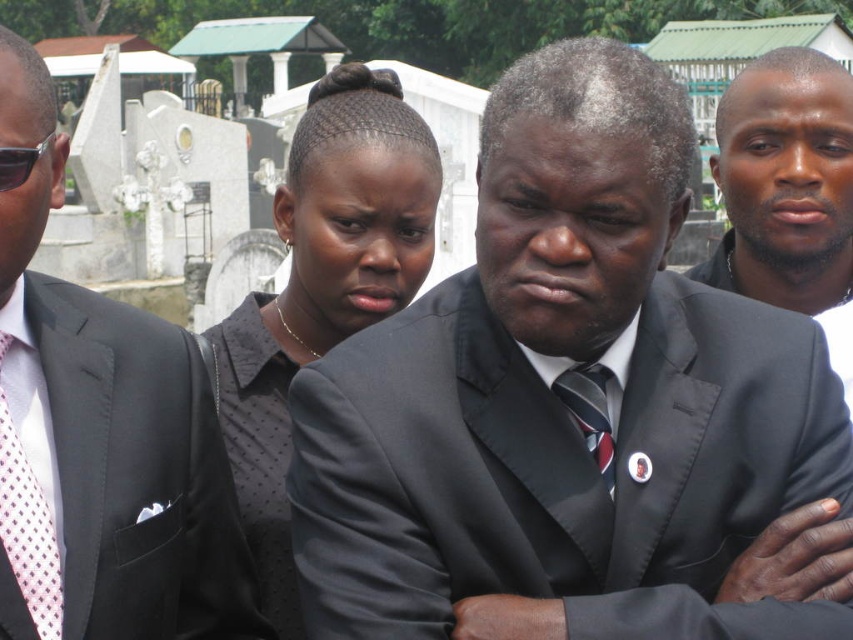
Question: Does pink dotted tie at left appear over black plastic sunglasses at left?

Choices:
 (A) yes
 (B) no

Answer: (B)

Question: Which object is the farthest from the black plastic sunglasses at left?

Choices:
 (A) striped silk tie at center
 (B) smooth black suit at right
 (C) pink dotted tie at left
 (D) matte black suit at center

Answer: (B)

Question: Is black dotted shirt at center positioned in front of striped silk tie at center?

Choices:
 (A) no
 (B) yes

Answer: (A)

Question: Is black matte suit at center smaller than black plastic sunglasses at left?

Choices:
 (A) yes
 (B) no

Answer: (B)

Question: Which object appears closest to the camera in this image?

Choices:
 (A) black plastic sunglasses at left
 (B) black dotted shirt at center
 (C) smooth black suit at right

Answer: (A)

Question: Which point is closer to the camera taking this photo?

Choices:
 (A) (770, 296)
 (B) (16, 477)

Answer: (B)